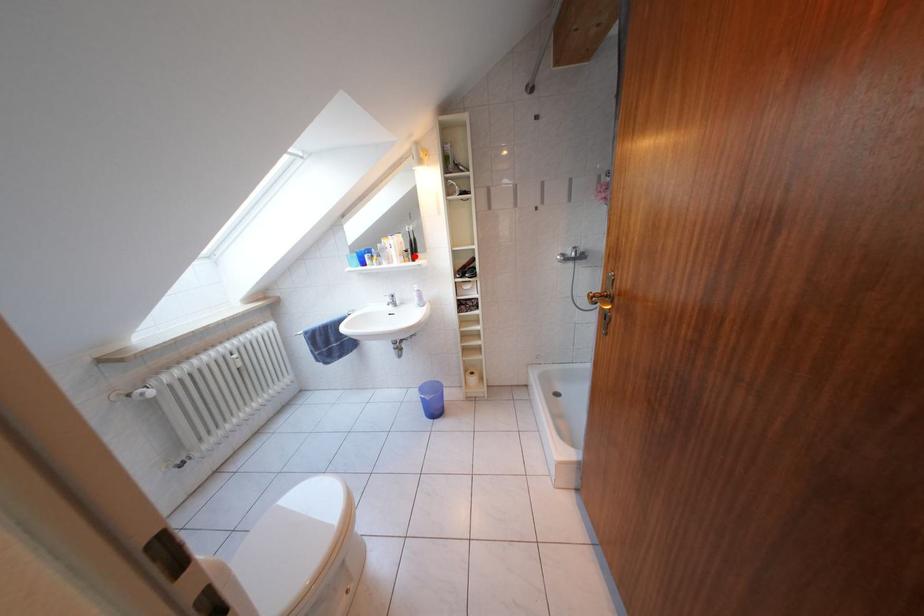
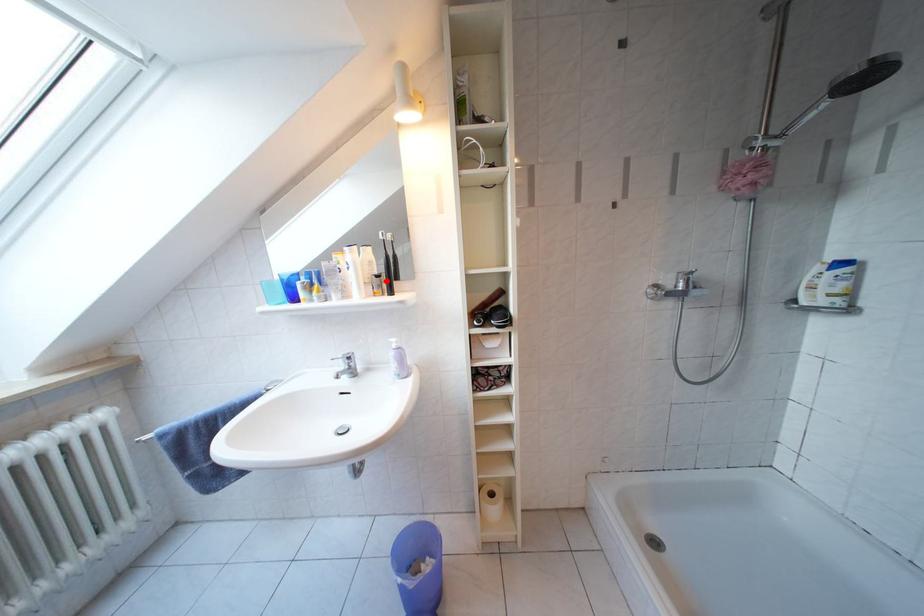
I am providing you with two images of the same scene from different viewpoints. A red point is marked on the first image and another point is marked on the second image. Is the red point in image1 aligned with the point shown in image2?

Yes